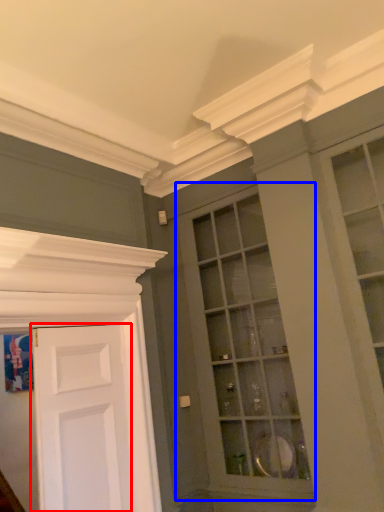
Question: Among these objects, which one is farthest to the camera, door (highlighted by a red box) or window (highlighted by a blue box)?

Choices:
 (A) door
 (B) window

Answer: (B)